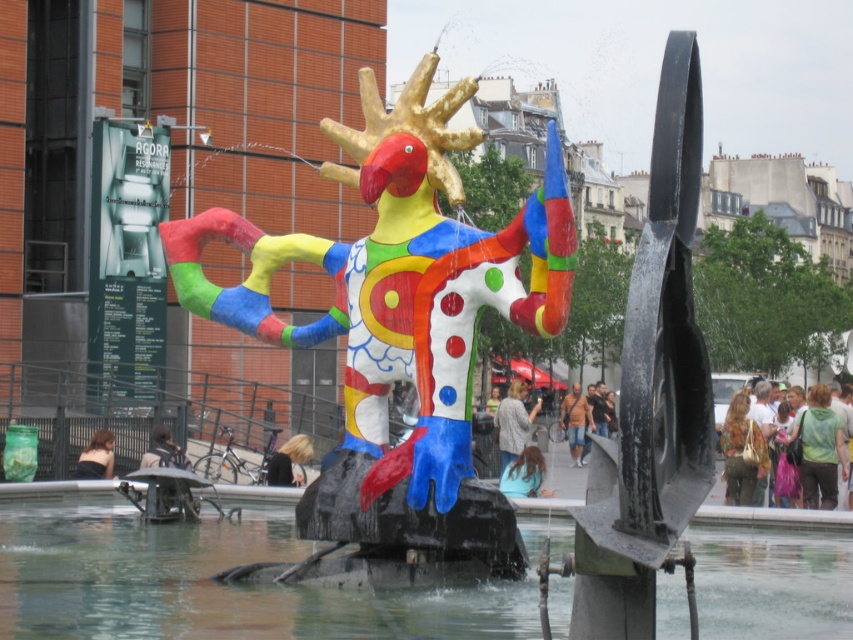
Question: Is green fabric purse at center right positioned at the back of blue fabric hair at center?

Choices:
 (A) yes
 (B) no

Answer: (A)

Question: Which object is the farthest from the blonde hair at center?

Choices:
 (A) multicolored painted sculpture at center
 (B) clear water at fountain center
 (C) green tie-dye hoodie at right

Answer: (C)

Question: Is light brown leather jacket at center smaller than blonde hair at center?

Choices:
 (A) yes
 (B) no

Answer: (B)

Question: Among these points, which one is nearest to the camera?

Choices:
 (A) (810, 468)
 (B) (576, 384)

Answer: (A)

Question: Can you confirm if green tie-dye hoodie at right is positioned to the left of black fabric person at lower left?

Choices:
 (A) no
 (B) yes

Answer: (A)

Question: Which of the following is the closest to the observer?

Choices:
 (A) matte gray sweater at center
 (B) multicolored painted sculpture at center
 (C) brown textured bag at center

Answer: (B)